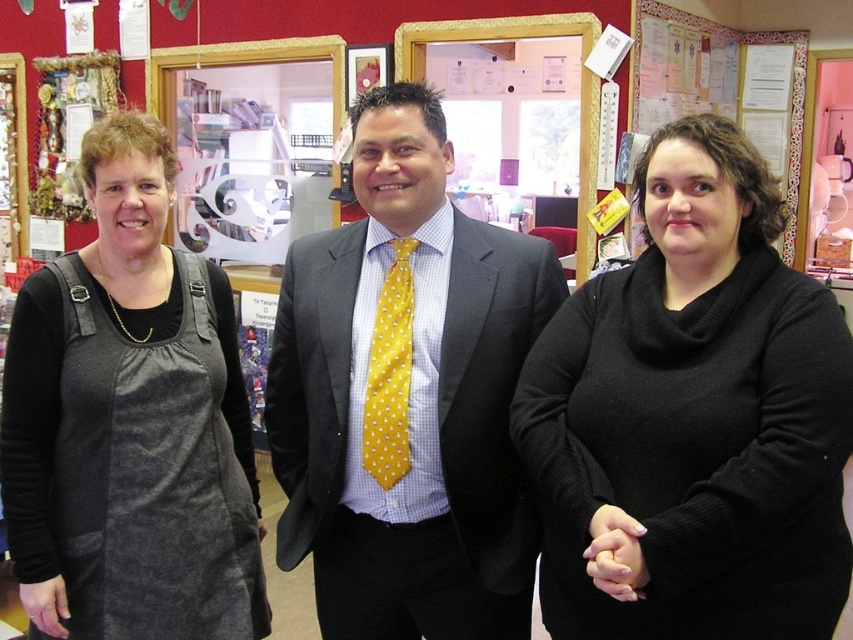
Consider the image. You are organizing a fashion show and need to know if the yellow dotted tie at center and the yellow dotted fabric tie at center are close enough to be displayed together in a 15 cm wide display case. Can they fit side by side?

The distance between the yellow dotted tie at center and the yellow dotted fabric tie at center is 13.15 centimeters, which is less than 15 cm, so they can fit side by side in the display case.

From the picture: You are organizing a photo shoot and need to arrange two props based on their positions in the scene. The yellow dotted tie at center and the dark gray fabric apron at left are both part of the setup. According to the scene, which prop is located to the right of the other?

The yellow dotted tie at center is positioned on the right side of the dark gray fabric apron at left, so the yellow dotted tie at center is to the right of the dark gray fabric apron at left.